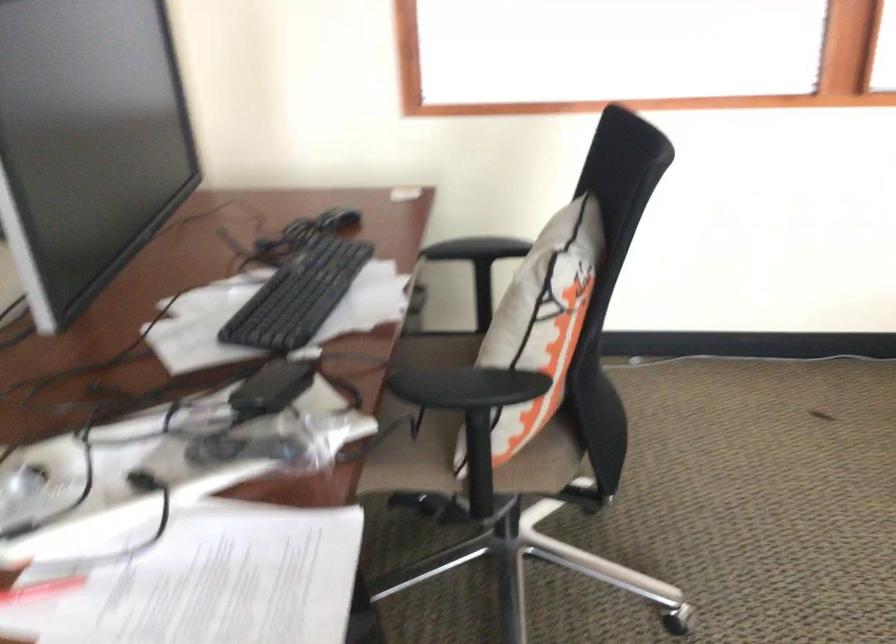
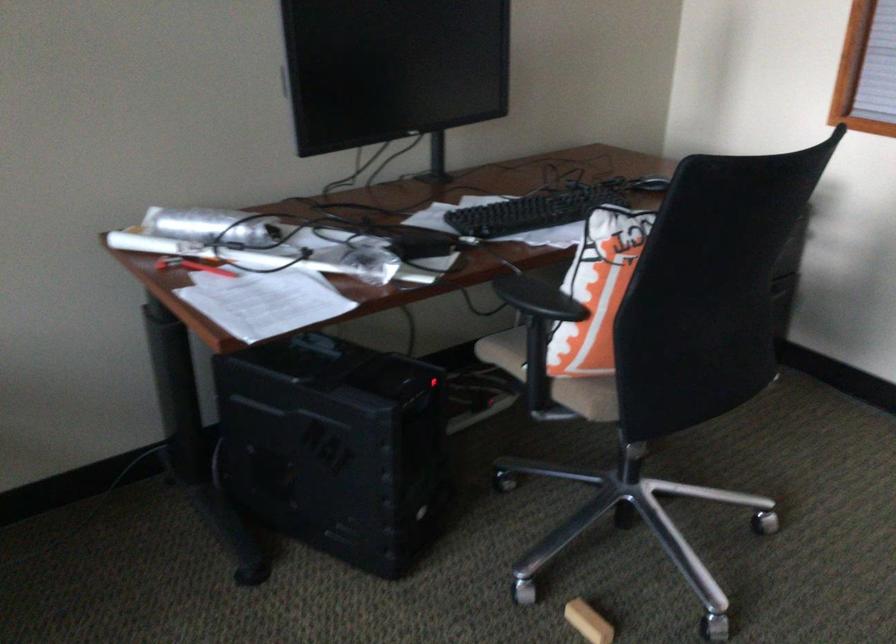
Find the pixel in the second image that matches (x=558, y=345) in the first image.

(597, 290)